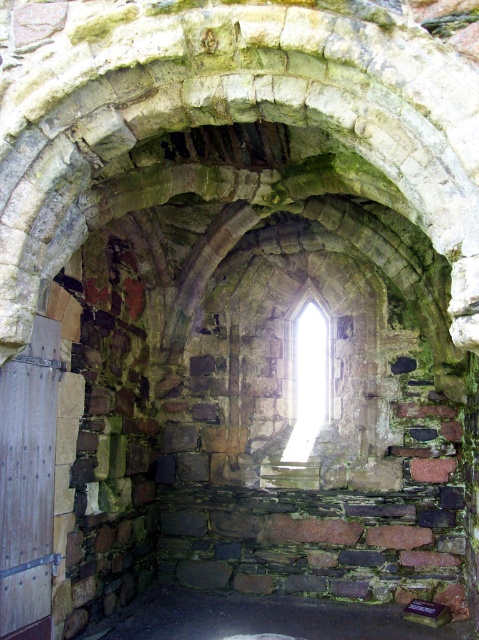
You are an architect examining the ancient stone structure. You need to determine the spatial relationship between the dark stone floor at center and the clear glass window at center. Which object is located below the other?

The dark stone floor at center is positioned under the clear glass window at center, meaning the floor is below the window.

You are an architect examining the ancient stone structure. You notice the dark stone floor at center and the clear glass window at center. Which object occupies a larger area in the scene?

The dark stone floor at center is bigger than the clear glass window at center, so the dark stone floor at center occupies a larger area in the scene.